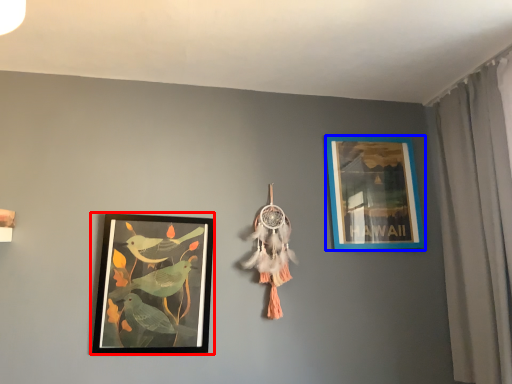
Question: Which object appears farthest to the camera in this image, picture frame (highlighted by a red box) or picture frame (highlighted by a blue box)?

Choices:
 (A) picture frame
 (B) picture frame

Answer: (B)